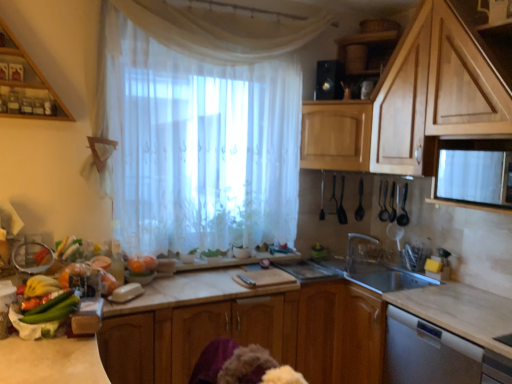
Question: Based on their sizes in the image, would you say wooden cabinet at upper left, which is counted as the first cabinetry, starting from the top, is bigger or smaller than marble countertop at center?

Choices:
 (A) big
 (B) small

Answer: (B)

Question: Is wooden cabinet at upper left, which is counted as the first cabinetry, starting from the top, taller or shorter than marble countertop at center?

Choices:
 (A) short
 (B) tall

Answer: (A)

Question: Estimate the real-world distances between objects in this image. Which object is closer to the black plastic spoons at upper right, the third appliance from the left?

Choices:
 (A) black plastic speaker at upper center, the 2th appliance from the left
 (B) black plastic utensils at upper right, the 7th appliance when ordered from left to right
 (C) white marble countertop at lower right
 (D) wooden cabinet at center, the 1th cabinetry positioned from the bottom
 (E) marble countertop at center

Answer: (B)

Question: Which of these objects is positioned closest to the white marble countertop at lower right?

Choices:
 (A) black plastic speaker at upper center, which is the sixth appliance in right-to-left order
 (B) black plastic spoon at upper center, arranged as the 7th appliance when viewed from the right
 (C) wooden cabinet at upper right, which ranks as the second cabinetry in bottom-to-top order
 (D) black plastic spoons at upper right, arranged as the 4th appliance when viewed from the right
 (E) black plastic spoons at upper right, arranged as the sixth appliance when viewed from the left

Answer: (C)